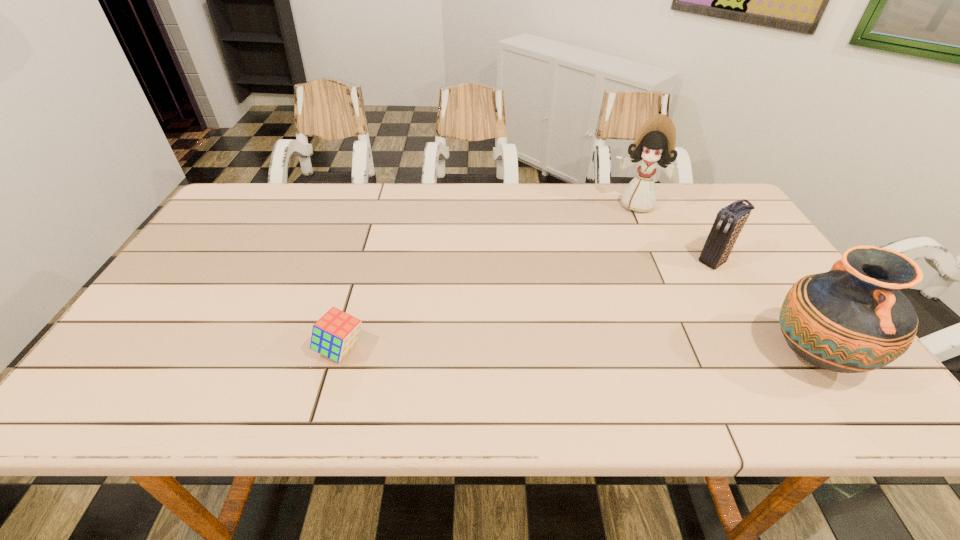
This screenshot has width=960, height=540. What are the coordinates of `vacant spot on the desktop that is between the leftmost object and the pottery and is positioned with the zip open on the third tallest object` in the screenshot? It's located at (575, 353).

Locate an element on the screen. The image size is (960, 540). free spot on the desktop that is between the shortest object and the pottery and is positioned at the front face of the third object from right to left is located at coordinates (605, 353).